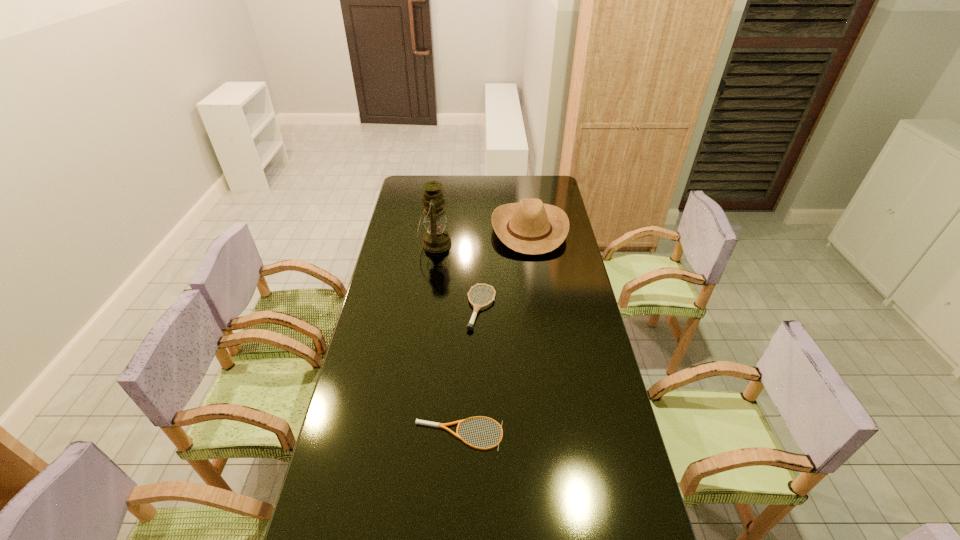
Locate an element on the screen. This screenshot has height=540, width=960. the tallest object is located at coordinates (436, 239).

Identify the location of cowboy hat. (531, 227).

Identify the location of the taller tennis racket. The image size is (960, 540). (469, 326).

This screenshot has width=960, height=540. What are the coordinates of `the farther tennis racket` in the screenshot? It's located at (469, 326).

You are a GUI agent. You are given a task and a screenshot of the screen. Output one action in this format:
    pyautogui.click(x=<x>, y=<y>)
    Task: Click on the shorter tennis racket
    This screenshot has height=540, width=960.
    Given the screenshot: What is the action you would take?
    pyautogui.click(x=422, y=422)

This screenshot has width=960, height=540. I want to click on the shortest object, so click(x=422, y=422).

The image size is (960, 540). Find the location of `vacant space located 0.120m on the right of the oil lamp`. vacant space located 0.120m on the right of the oil lamp is located at coordinates (477, 244).

The image size is (960, 540). What are the coordinates of `vacant area situated on the front-facing side of the cowboy hat` in the screenshot? It's located at (433, 230).

Where is `vacant space positioned on the front-facing side of the cowboy hat`? vacant space positioned on the front-facing side of the cowboy hat is located at coordinates (411, 230).

In order to click on free space located on the front-facing side of the cowboy hat in this screenshot , I will do `click(454, 230)`.